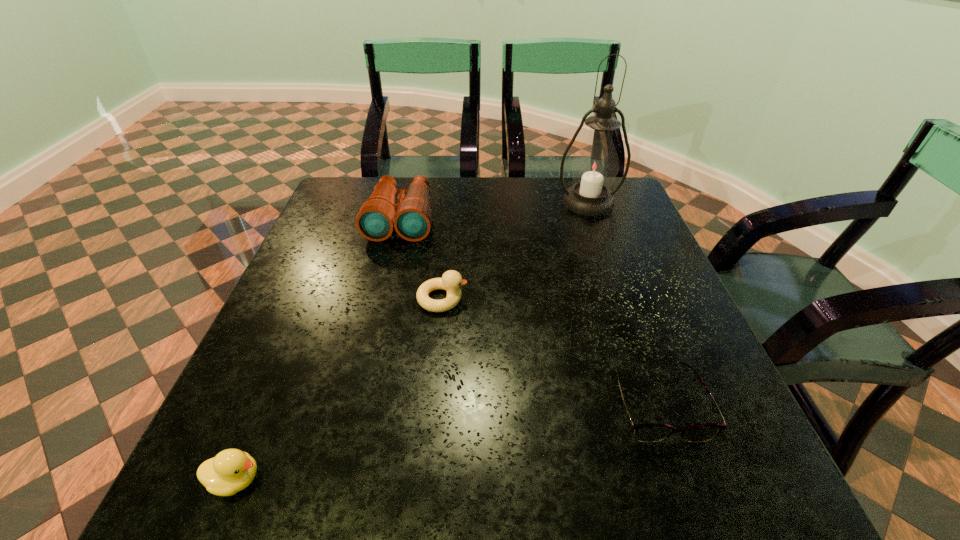
The width and height of the screenshot is (960, 540). Find the location of `free space between the spectacles and the fourth shortest object`. free space between the spectacles and the fourth shortest object is located at coordinates (530, 310).

What are the coordinates of `free spot between the leftmost object and the third farthest object` in the screenshot? It's located at (339, 389).

Find the location of a particular element. The image size is (960, 540). vacant space that's between the spectacles and the tallest object is located at coordinates (623, 302).

Locate an element on the screen. Image resolution: width=960 pixels, height=540 pixels. vacant point located between the tallest object and the right duckling is located at coordinates (516, 251).

Locate an element on the screen. The image size is (960, 540). free space between the third farthest object and the fourth farthest object is located at coordinates (550, 350).

Where is `vacant area between the fourth farthest object and the binoculars`? The height and width of the screenshot is (540, 960). vacant area between the fourth farthest object and the binoculars is located at coordinates (530, 310).

What are the coordinates of `empty location between the right duckling and the fourth farthest object` in the screenshot? It's located at (550, 350).

Find the location of `free point between the tallest object and the second tallest object`. free point between the tallest object and the second tallest object is located at coordinates (494, 211).

The image size is (960, 540). I want to click on object that ranks as the third closest to the oil lamp, so click(x=648, y=432).

The width and height of the screenshot is (960, 540). Identify the location of object that is the closest to the fourth shortest object. (451, 280).